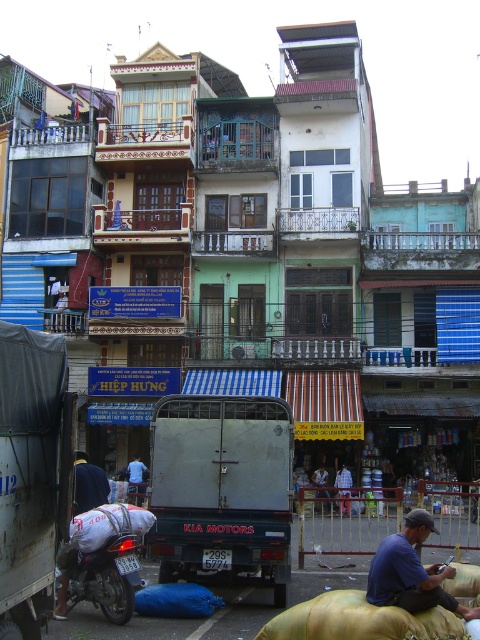
Question: Which point is closer to the camera?

Choices:
 (A) blue fabric bag at lower left
 (B) blue cotton shirt at lower right
 (C) dark blue shirt at center
 (D) metallic gray truck at center

Answer: (B)

Question: Can you confirm if dark blue shirt at center is bigger than blue striped shirt at center?

Choices:
 (A) no
 (B) yes

Answer: (A)

Question: Does rusty metal truck at lower left have a greater width compared to blue cotton shirt at lower right?

Choices:
 (A) yes
 (B) no

Answer: (A)

Question: Which of these objects is positioned closest to the dark blue shirt at center?

Choices:
 (A) blue cotton shirt at lower right
 (B) blue striped shirt at center

Answer: (A)

Question: Is rusty metal truck at lower left to the right of blue cotton shirt at lower right from the viewer's perspective?

Choices:
 (A) yes
 (B) no

Answer: (B)

Question: Which object is the farthest from the blue cotton shirt at lower right?

Choices:
 (A) rusty metal truck at lower left
 (B) metallic silver motorcycle at lower left
 (C) dark blue shirt at center
 (D) metallic gray truck at center

Answer: (C)